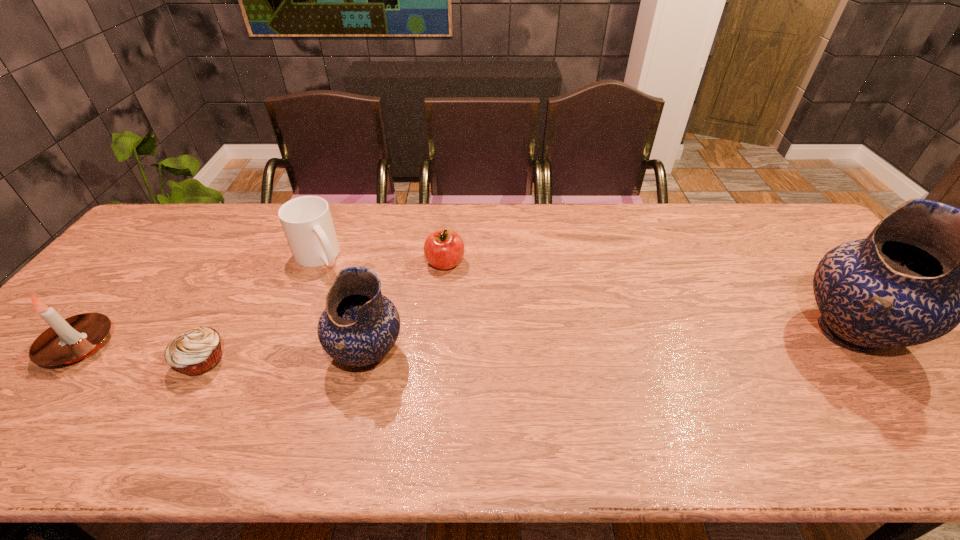
Identify the location of blank space located on the left of the left pottery. The width and height of the screenshot is (960, 540). (211, 354).

You are a GUI agent. You are given a task and a screenshot of the screen. Output one action in this format:
    pyautogui.click(x=<x>, y=<y>)
    Task: Click on the blank area located 0.070m on the back of the right pottery
    This screenshot has width=960, height=540.
    Given the screenshot: What is the action you would take?
    pyautogui.click(x=805, y=277)

The width and height of the screenshot is (960, 540). Find the location of `free location located 0.210m on the back of the mug`. free location located 0.210m on the back of the mug is located at coordinates (342, 202).

Locate an element on the screen. vacant area situated on the right of the fifth object from left to right is located at coordinates (578, 263).

Identify the location of free space located on the back of the leftmost object. (156, 253).

You are a GUI agent. You are given a task and a screenshot of the screen. Output one action in this format:
    pyautogui.click(x=<x>, y=<y>)
    Task: Click on the vacant space located 0.190m on the right of the muffin
    The height and width of the screenshot is (540, 960).
    Given the screenshot: What is the action you would take?
    pyautogui.click(x=305, y=361)

The height and width of the screenshot is (540, 960). I want to click on object situated at the far edge, so 307,223.

Identify the location of pottery that is positioned at the near edge. The width and height of the screenshot is (960, 540). (359, 326).

In order to click on muffin present at the near edge in this screenshot , I will do `click(196, 351)`.

Where is `object positioned at the left edge`? This screenshot has width=960, height=540. object positioned at the left edge is located at coordinates (69, 340).